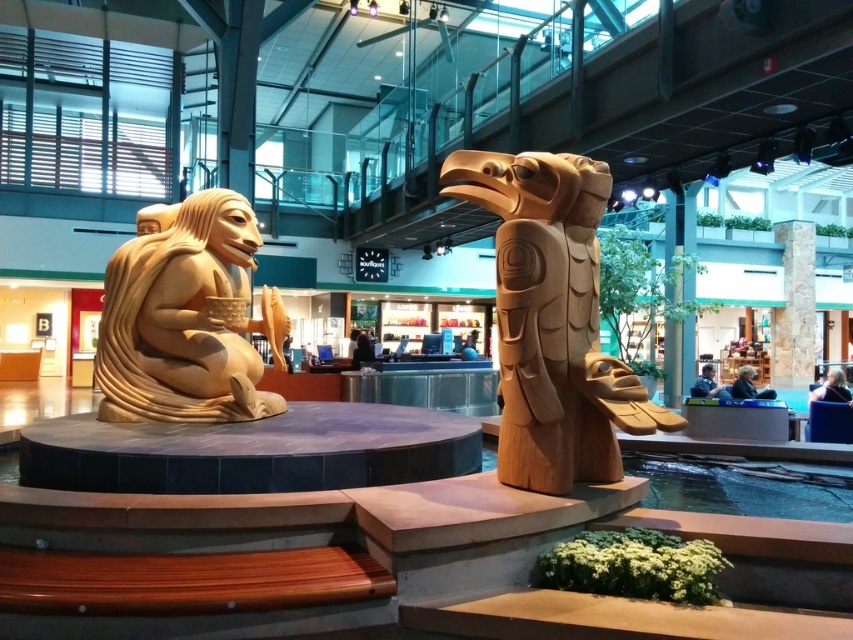
Can you confirm if wooden totem at center is positioned below stone textured pillar at center?

Indeed, wooden totem at center is positioned under stone textured pillar at center.

Is wooden totem at center smaller than stone textured pillar at center?

Indeed, wooden totem at center has a smaller size compared to stone textured pillar at center.

Does point (531, 202) come behind point (779, 376)?

No.

Locate an element on the screen. wooden totem at center is located at coordinates (552, 321).

From the picture: Is wooden carving at left shorter than stone textured pillar at center?

Indeed, wooden carving at left has a lesser height compared to stone textured pillar at center.

Does point (204, 296) lie behind point (785, 288)?

No, (204, 296) is in front of (785, 288).

Locate an element on the screen. The width and height of the screenshot is (853, 640). wooden carving at left is located at coordinates (186, 320).

Is point (579, 477) positioned behind point (97, 339)?

No, (579, 477) is in front of (97, 339).

Does wooden totem at center have a greater width compared to wooden carving at left?

Incorrect, wooden totem at center's width does not surpass wooden carving at left's.

Locate an element on the screen. The width and height of the screenshot is (853, 640). wooden totem at center is located at coordinates click(x=552, y=321).